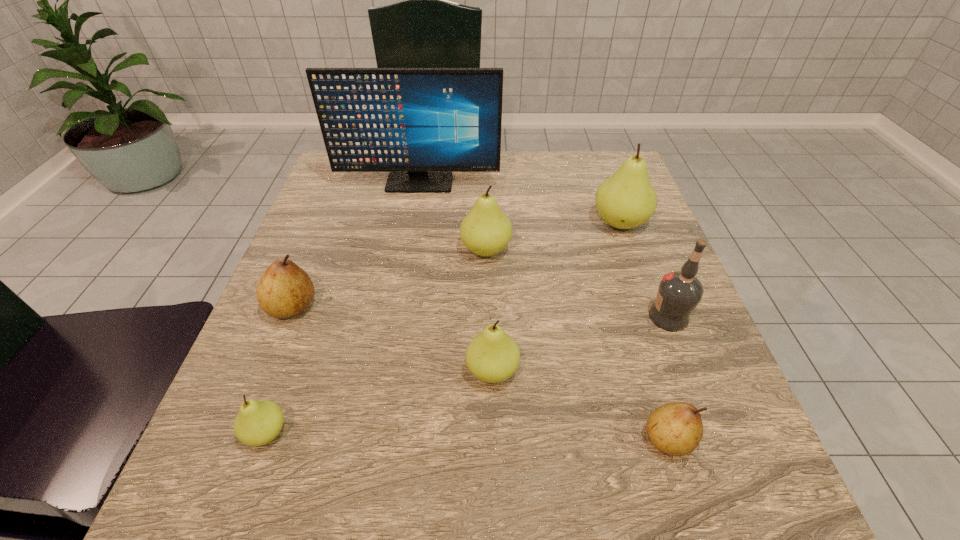
Find the location of a particular element. This screenshot has width=960, height=540. the smallest green pear is located at coordinates (258, 422).

Locate an element on the screen. the nearest green pear is located at coordinates (258, 422).

At what (x,y) coordinates should I click in order to perform the action: click on the smaller brown pear. Please return your answer as a coordinate pair (x, y). The image size is (960, 540). Looking at the image, I should click on (676, 428).

At what (x,y) coordinates should I click in order to perform the action: click on the nearer brown pear. Please return your answer as a coordinate pair (x, y). This screenshot has height=540, width=960. Looking at the image, I should click on (676, 428).

Locate an element on the screen. This screenshot has height=540, width=960. blank space located on the screen side of the tallest object is located at coordinates (414, 214).

Locate an element on the screen. vacant region located on the left of the rightmost green pear is located at coordinates (432, 223).

Where is `free space located on the front label of the vodka`? This screenshot has width=960, height=540. free space located on the front label of the vodka is located at coordinates (473, 316).

I want to click on free space located 0.070m on the front label of the vodka, so click(x=612, y=316).

Find the location of a particular element. This screenshot has height=540, width=960. vacant space located 0.240m on the front label of the vodka is located at coordinates (521, 316).

Identify the location of free region located on the back of the second biggest green pear. The width and height of the screenshot is (960, 540). (485, 174).